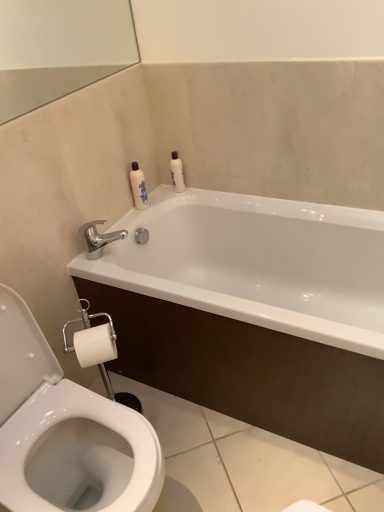
Question: From the image's perspective, would you say white glossy bottle at upper center, the 1th toiletry positioned from the left, is shown under white glossy bathtub at upper center?

Choices:
 (A) yes
 (B) no

Answer: (B)

Question: From the image's perspective, is white glossy bottle at upper center, the 1th toiletry positioned from the left, over white glossy bathtub at upper center?

Choices:
 (A) yes
 (B) no

Answer: (A)

Question: Considering the relative sizes of white glossy bottle at upper center, the 1th toiletry positioned from the left, and white glossy bathtub at upper center in the image provided, is white glossy bottle at upper center, the 1th toiletry positioned from the left, thinner than white glossy bathtub at upper center?

Choices:
 (A) yes
 (B) no

Answer: (A)

Question: Is white glossy bottle at upper center, the 2th toiletry in the right-to-left sequence, behind white glossy bathtub at upper center?

Choices:
 (A) no
 (B) yes

Answer: (B)

Question: Does white glossy bottle at upper center, the 2th toiletry in the right-to-left sequence, turn towards white glossy bathtub at upper center?

Choices:
 (A) no
 (B) yes

Answer: (A)

Question: In terms of height, does polished metallic faucet at upper left look taller or shorter compared to white glossy bathtub at upper center?

Choices:
 (A) short
 (B) tall

Answer: (A)

Question: From the image's perspective, relative to white glossy bathtub at upper center, is polished metallic faucet at upper left above or below?

Choices:
 (A) below
 (B) above

Answer: (B)

Question: From a real-world perspective, is polished metallic faucet at upper left physically located above or below white glossy bathtub at upper center?

Choices:
 (A) above
 (B) below

Answer: (A)

Question: Does point (89, 246) appear closer or farther from the camera than point (89, 261)?

Choices:
 (A) farther
 (B) closer

Answer: (A)

Question: Which is correct: white glossy bottle at upper right, arranged as the first toiletry when viewed from the right, is inside polished metallic faucet at upper left, or outside of it?

Choices:
 (A) outside
 (B) inside

Answer: (A)

Question: Is point (178, 166) closer or farther from the camera than point (107, 237)?

Choices:
 (A) closer
 (B) farther

Answer: (B)

Question: From the image's perspective, is white glossy bottle at upper right, arranged as the first toiletry when viewed from the right, located above or below polished metallic faucet at upper left?

Choices:
 (A) above
 (B) below

Answer: (A)

Question: Is white glossy bottle at upper right, placed as the second toiletry when sorted from left to right, in front of or behind polished metallic faucet at upper left in the image?

Choices:
 (A) front
 (B) behind

Answer: (B)

Question: From a real-world perspective, is white glossy bathtub at upper center physically located above or below polished metallic faucet at upper left?

Choices:
 (A) below
 (B) above

Answer: (A)

Question: Considering the positions of white glossy bathtub at upper center and polished metallic faucet at upper left in the image, is white glossy bathtub at upper center bigger or smaller than polished metallic faucet at upper left?

Choices:
 (A) big
 (B) small

Answer: (A)